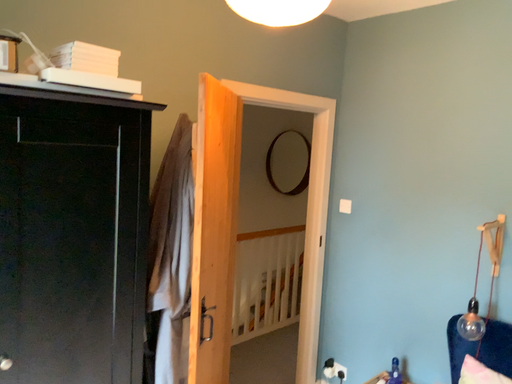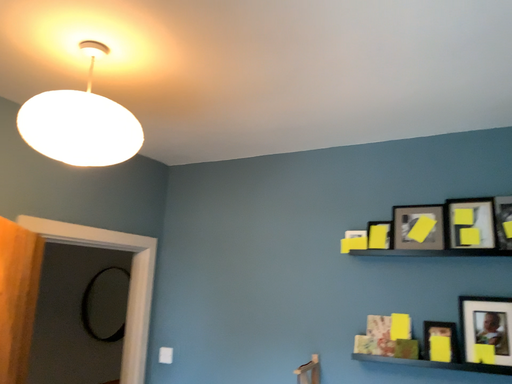
Question: How did the camera likely rotate when shooting the video?

Choices:
 (A) rotated downward
 (B) rotated upward

Answer: (B)